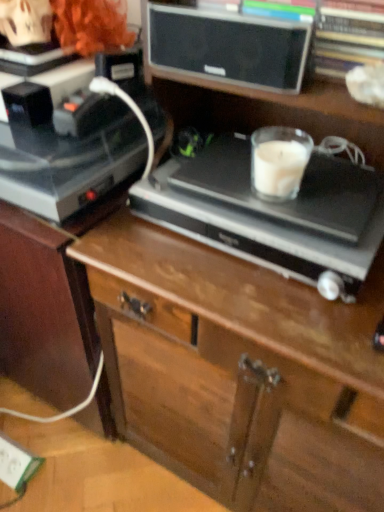
Locate an element on the screen. The height and width of the screenshot is (512, 384). free space above satin black record player at center, the first appliance positioned from the right (from a real-world perspective) is located at coordinates (277, 201).